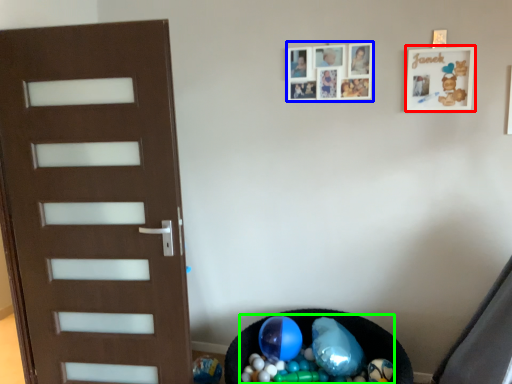
Question: Which object is the farthest from picture frame (highlighted by a red box)? Choose among these: picture frame (highlighted by a blue box) or garbage (highlighted by a green box).

Choices:
 (A) picture frame
 (B) garbage

Answer: (B)